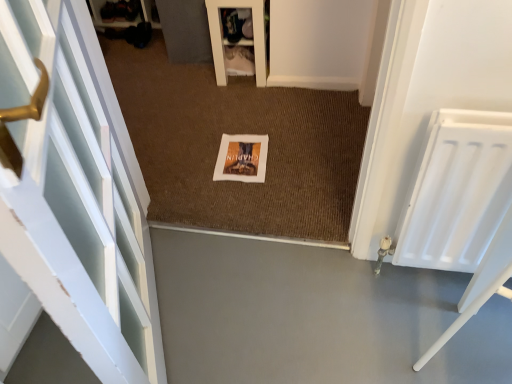
Where is `free spot below white matte picture frame at center (from a real-world perspective)`? This screenshot has width=512, height=384. free spot below white matte picture frame at center (from a real-world perspective) is located at coordinates (243, 155).